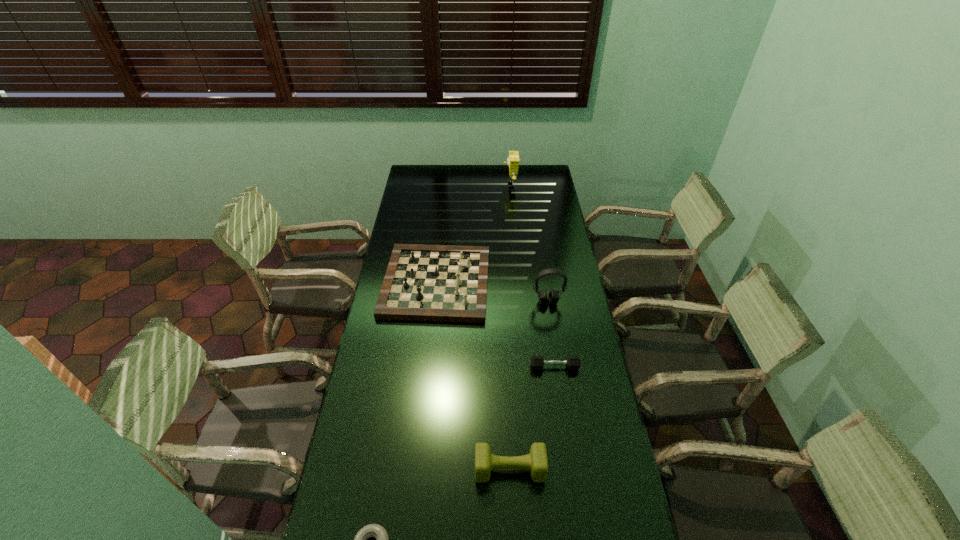
In order to click on vacant region at the right edge of the desktop in this screenshot , I will do `click(554, 322)`.

What are the coordinates of `vacant space at the far left corner of the desktop` in the screenshot? It's located at (409, 172).

In the image, there is a desktop. Where is `vacant space at the far right corner`? The width and height of the screenshot is (960, 540). vacant space at the far right corner is located at coordinates (535, 168).

Locate an element on the screen. empty location between the headset and the third nearest object is located at coordinates (551, 334).

This screenshot has width=960, height=540. What are the coordinates of `free point between the chessboard and the headset` in the screenshot? It's located at (492, 292).

Where is `free spot between the chessboard and the fifth tallest object`? The image size is (960, 540). free spot between the chessboard and the fifth tallest object is located at coordinates (495, 325).

What are the coordinates of `empty space that is in between the shorter dumbbell and the sponge` in the screenshot? It's located at (532, 276).

This screenshot has width=960, height=540. What are the coordinates of `vacant space that is in between the chessboard and the taller dumbbell` in the screenshot? It's located at (473, 376).

Identify which object is the second closest to the chessboard. Please provide its 2D coordinates. Your answer should be formatted as a tuple, i.e. [(x, y)], where the tuple contains the x and y coordinates of a point satisfying the conditions above.

[(537, 362)]

Select which object appears as the fifth closest to the chessboard. Please provide its 2D coordinates. Your answer should be formatted as a tuple, i.e. [(x, y)], where the tuple contains the x and y coordinates of a point satisfying the conditions above.

[(378, 532)]